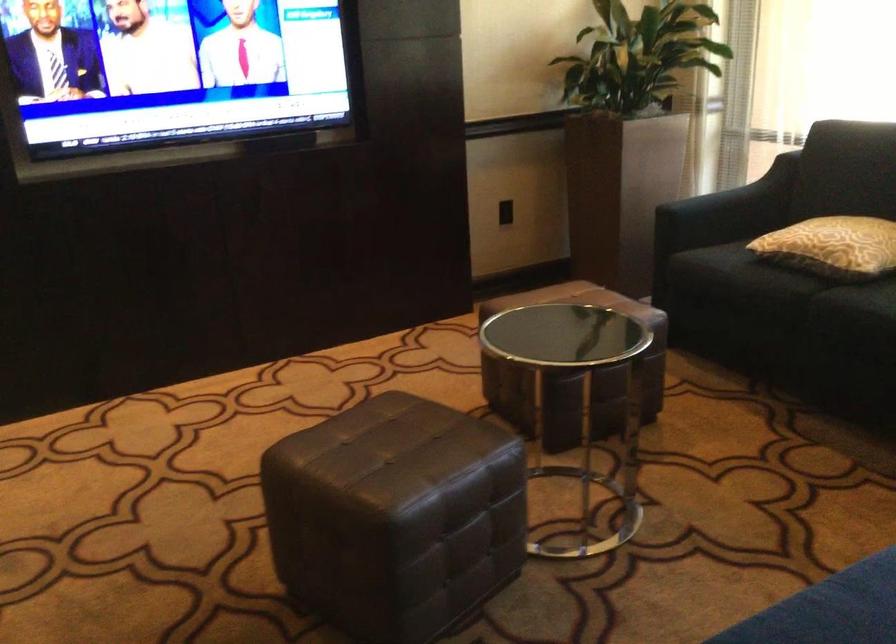
This screenshot has height=644, width=896. Describe the element at coordinates (742, 196) in the screenshot. I see `the sofa armrest` at that location.